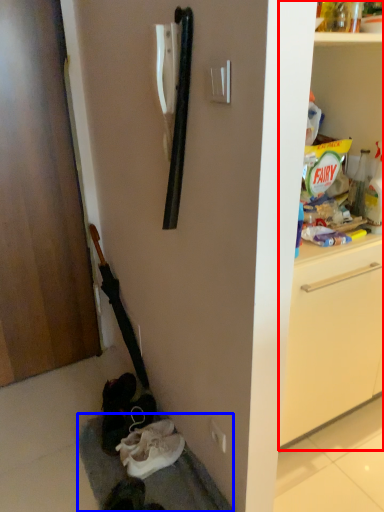
Question: Which object is closer to the camera taking this photo, shelf (highlighted by a red box) or gray (highlighted by a blue box)?

Choices:
 (A) shelf
 (B) gray

Answer: (A)